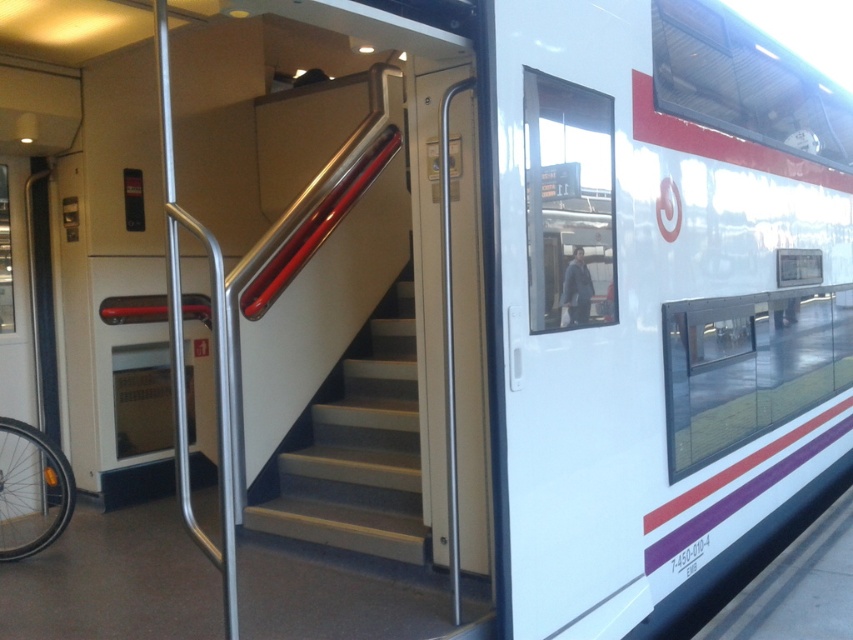
You are a passenger trying to board the train. You see the white matte stairs at center and the silver metallic bicycle wheel at lower left. Which object is located higher up in the image?

The white matte stairs at center is positioned over the silver metallic bicycle wheel at lower left, so it is higher up in the image.

You are a passenger holding a bicycle and standing at the train entrance. You see the white matte stairs at center and the silver metallic bicycle wheel at lower left. Which object is taller?

The white matte stairs at center is much taller than the silver metallic bicycle wheel at lower left.